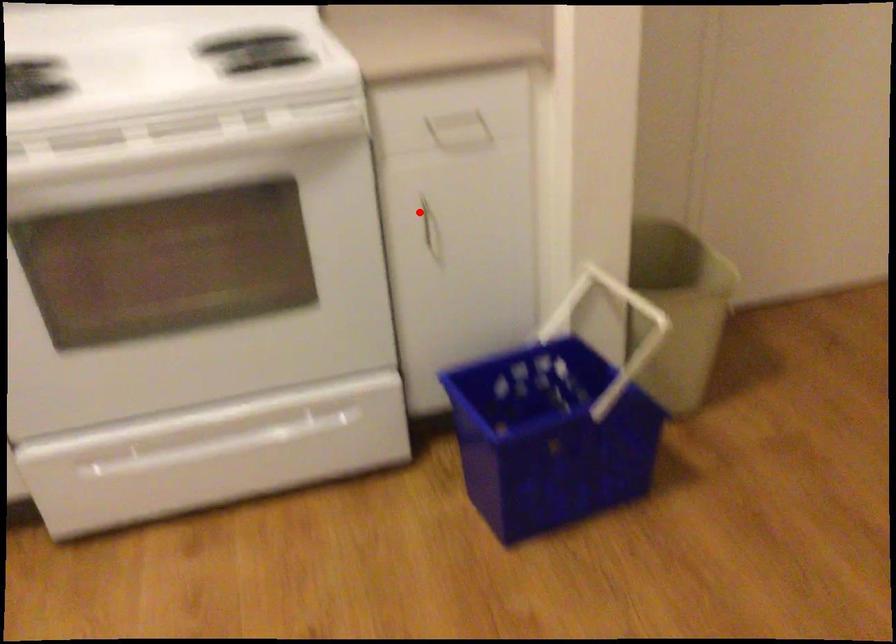
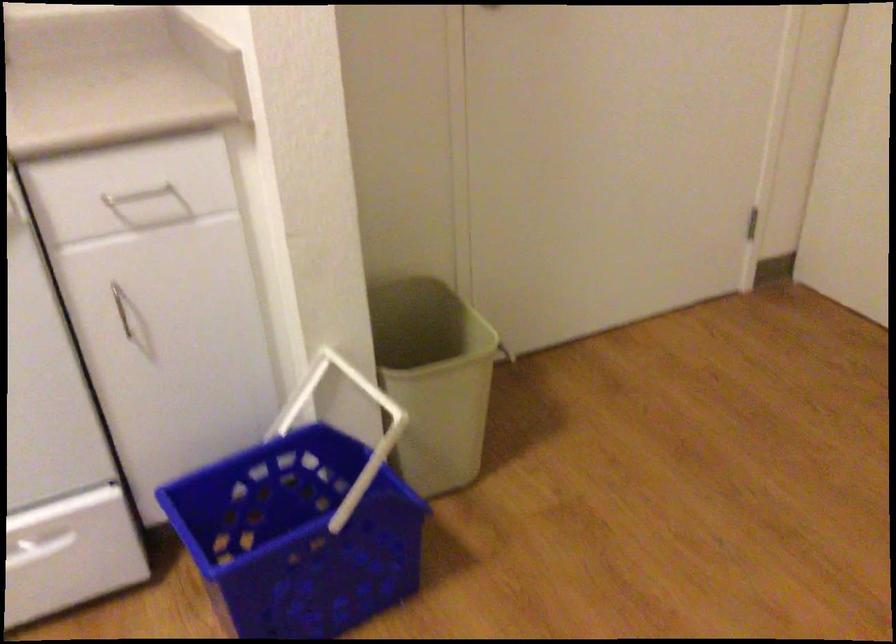
Question: I am providing you with two images of the same scene from different viewpoints. Image1 has a red point marked. In image2, the corresponding 3D location appears at what relative position? Reply with the corresponding letter.

Choices:
 (A) Closer
 (B) Farther

Answer: (A)